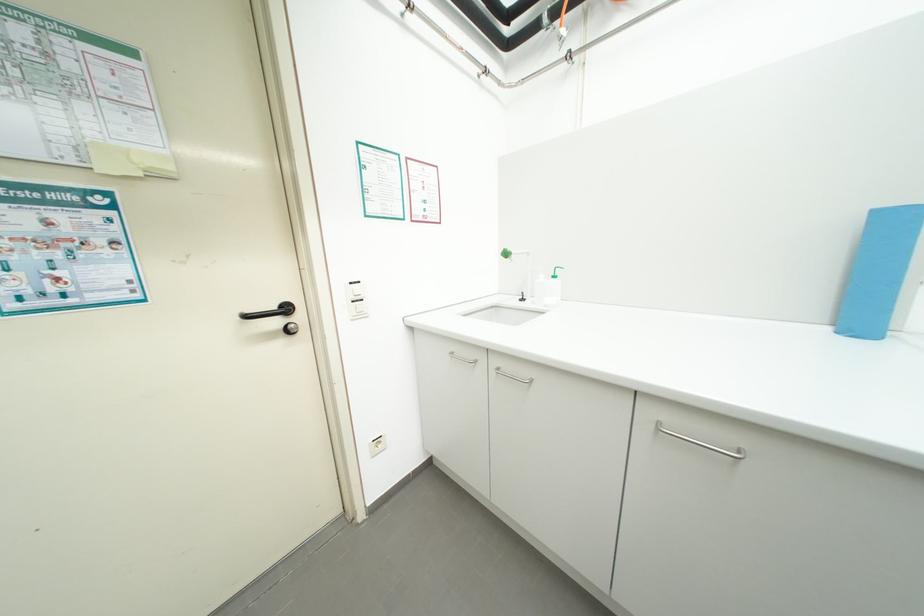
Identify the location of black door handle. The image size is (924, 616). (274, 314).